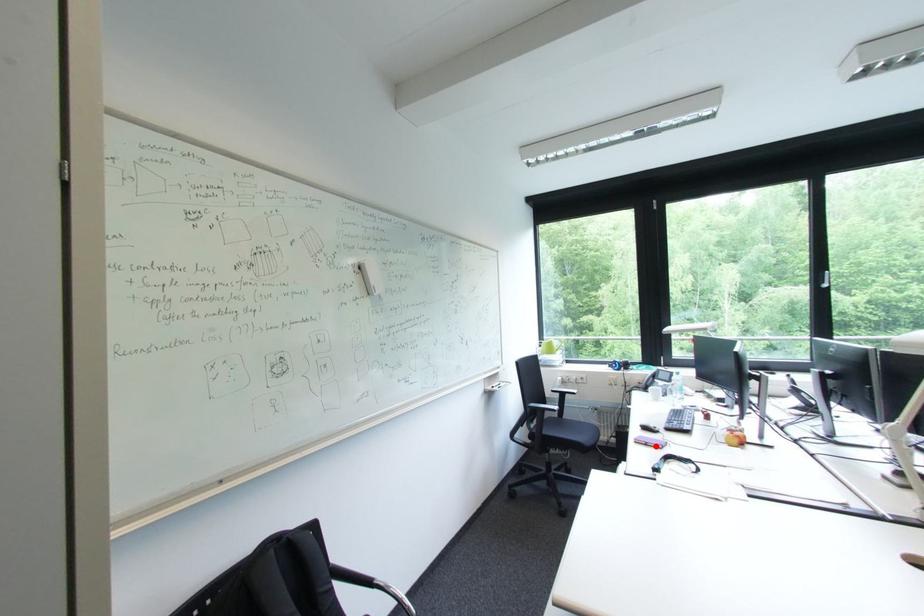
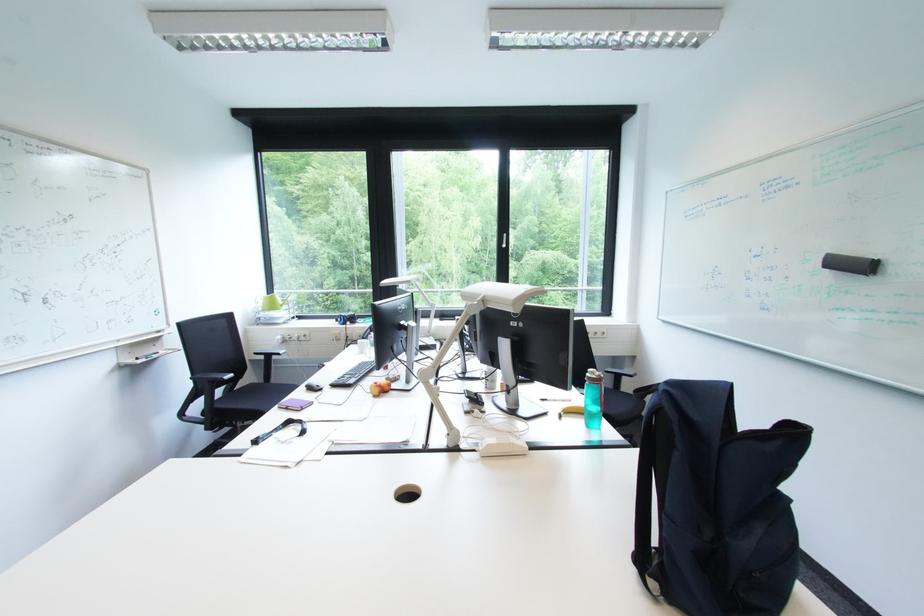
Locate, in the second image, the point that corresponds to the highlighted location in the first image.

(297, 410)